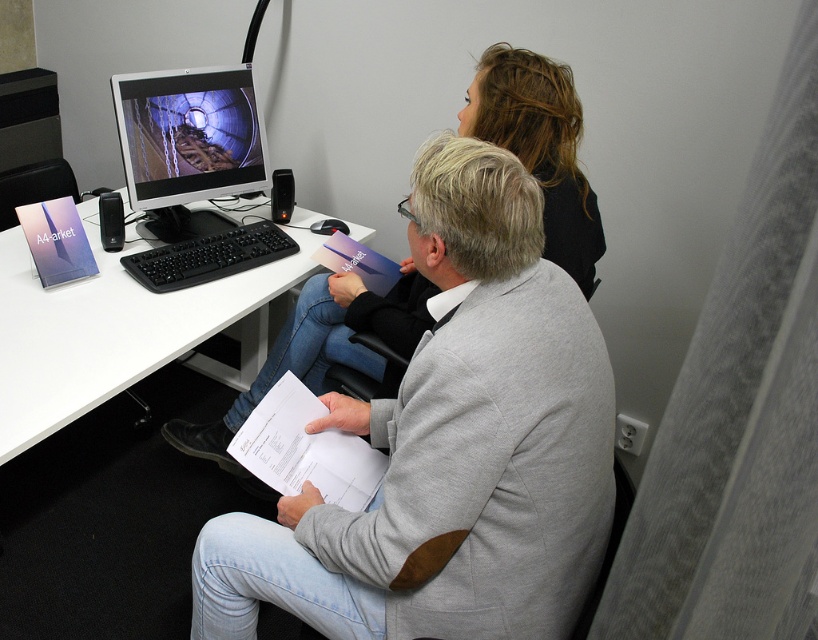
Question: Is white plastic computer desk at lower left to the right of black fabric hair at upper center from the viewer's perspective?

Choices:
 (A) yes
 (B) no

Answer: (B)

Question: Considering the relative positions of black fabric hair at upper center and matte black monitor at center in the image provided, where is black fabric hair at upper center located with respect to matte black monitor at center?

Choices:
 (A) right
 (B) left

Answer: (A)

Question: Which point is closer to the camera taking this photo?

Choices:
 (A) (237, 472)
 (B) (129, 179)
 (C) (97, 381)

Answer: (C)

Question: Based on their relative distances, which object is nearer to the black fabric hair at upper center?

Choices:
 (A) white plastic computer desk at lower left
 (B) matte black monitor at center

Answer: (A)

Question: Can you confirm if white plastic computer desk at lower left is positioned to the right of matte black monitor at center?

Choices:
 (A) no
 (B) yes

Answer: (A)

Question: Which of the following is the closest to the observer?

Choices:
 (A) (136, 336)
 (B) (560, 256)

Answer: (B)